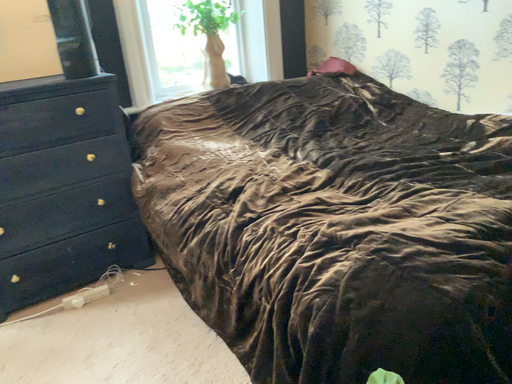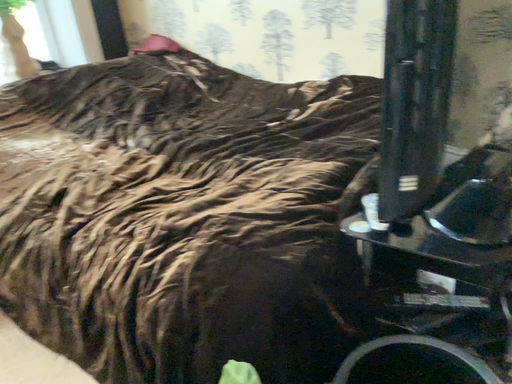
Question: Which way did the camera rotate in the video?

Choices:
 (A) rotated left
 (B) rotated right

Answer: (B)